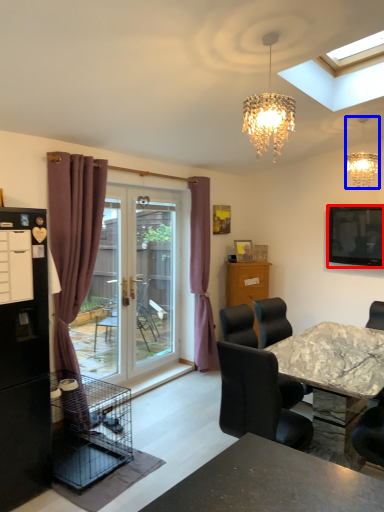
Question: Among these objects, which one is nearest to the camera, television (highlighted by a red box) or lamp (highlighted by a blue box)?

Choices:
 (A) television
 (B) lamp

Answer: (B)